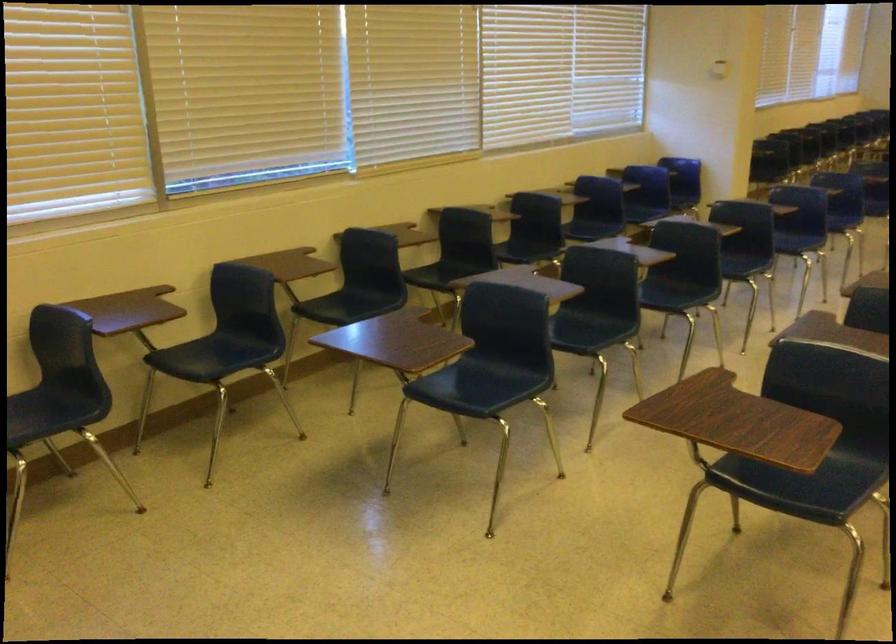
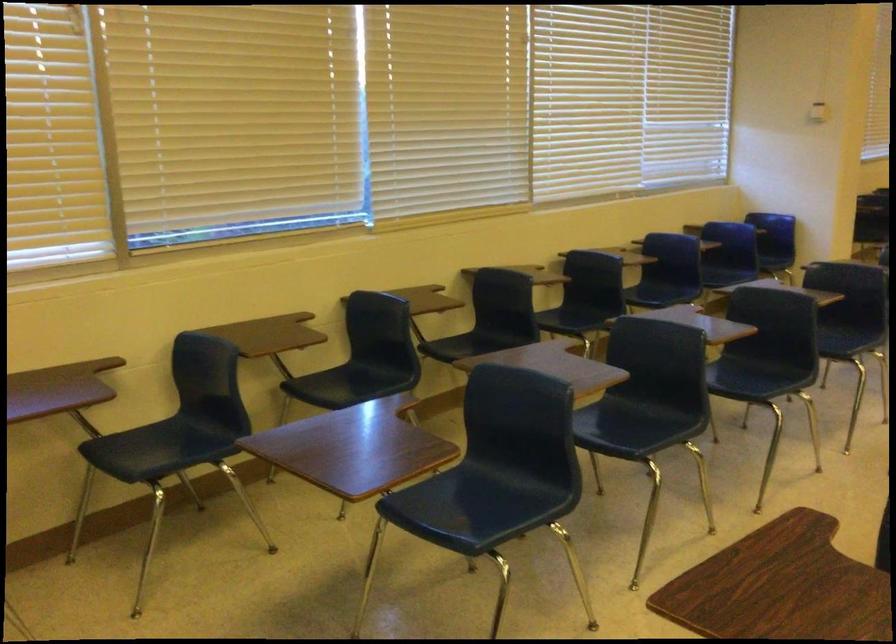
The images are taken continuously from a first-person perspective. In which direction are you moving?

The cameraman moved toward right, forward.